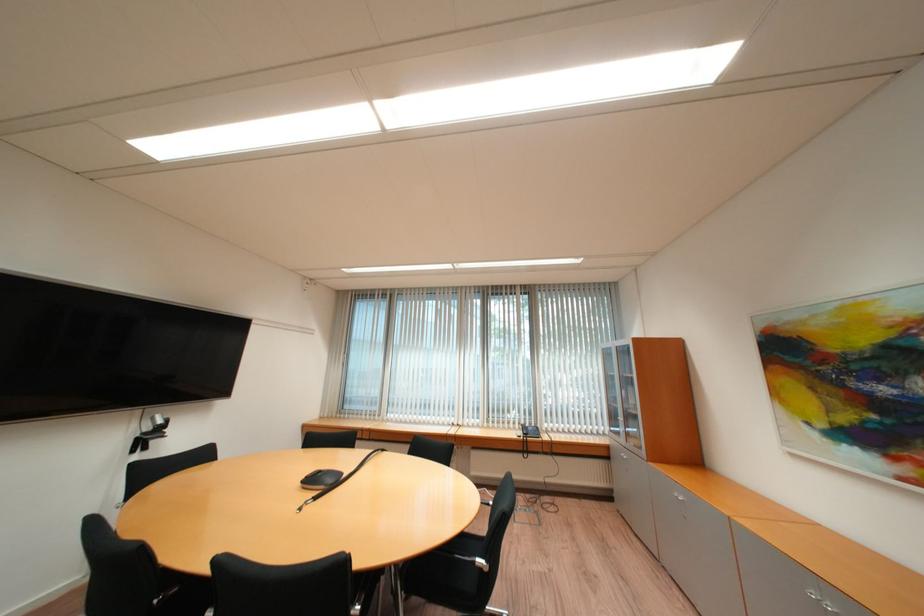
Image resolution: width=924 pixels, height=616 pixels. I want to click on silver cabinet handle, so click(677, 496).